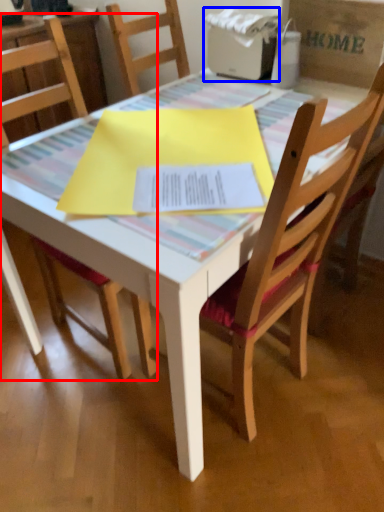
Question: Which of the following is the closest to the observer, chair (highlighted by a red box) or printer (highlighted by a blue box)?

Choices:
 (A) chair
 (B) printer

Answer: (A)